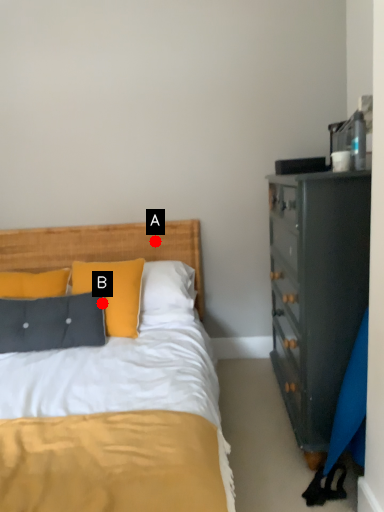
Question: Two points are circled on the image, labeled by A and B beside each circle. Among these points, which one is farthest from the camera?

Choices:
 (A) A is further
 (B) B is further

Answer: (A)